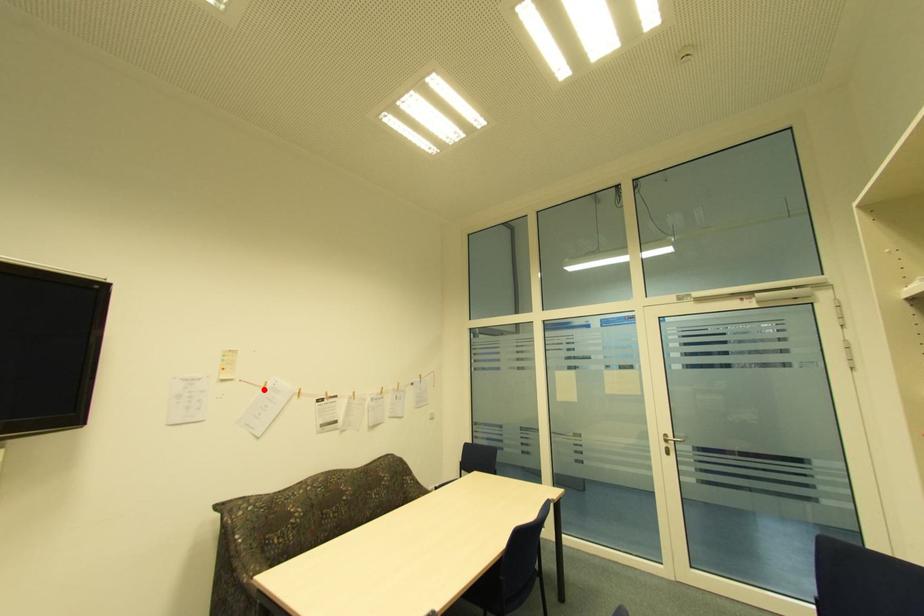
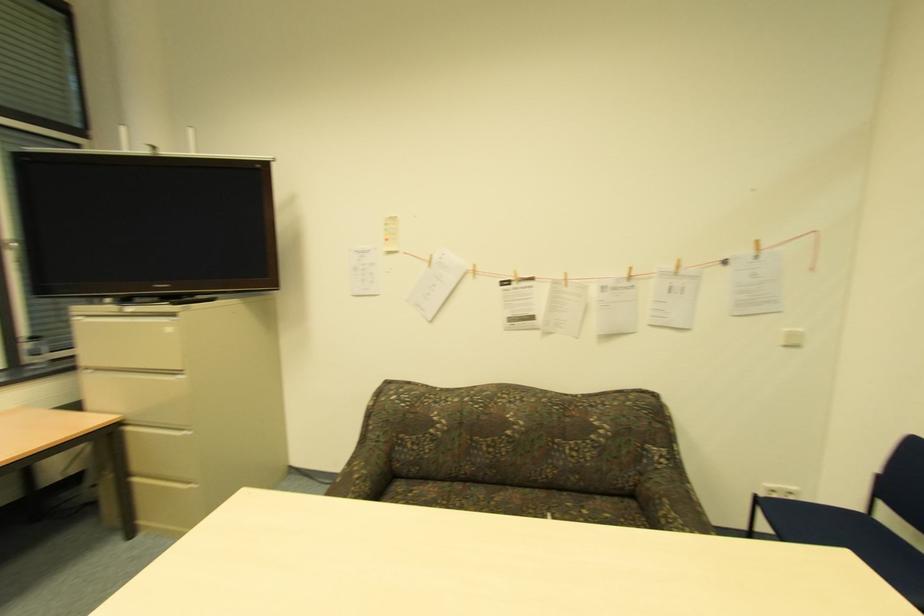
Question: I am providing you with two images of the same scene from different viewpoints. Image1 has a red point marked. In image2, the corresponding 3D location appears at what relative position? Reply with the corresponding letter.

Choices:
 (A) Closer
 (B) Farther

Answer: (A)